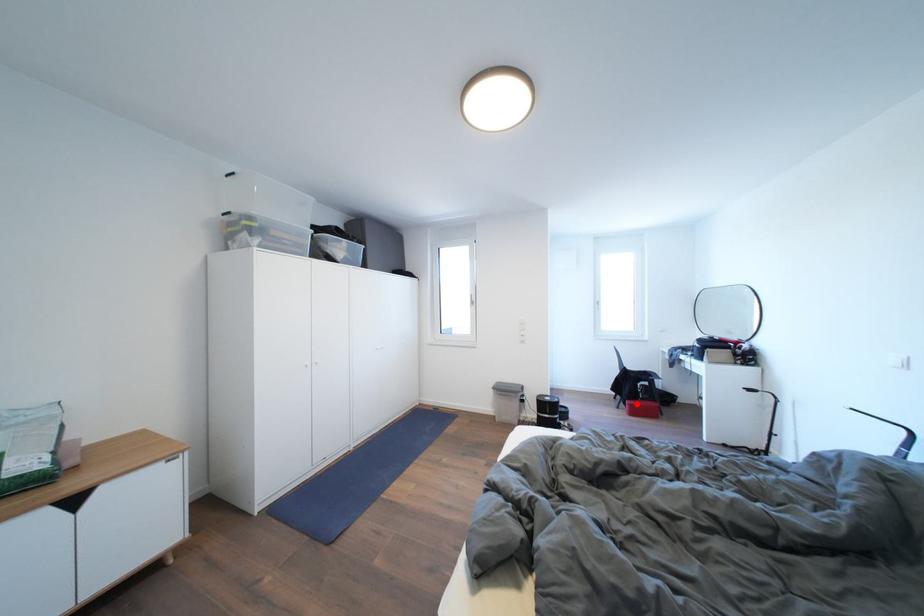
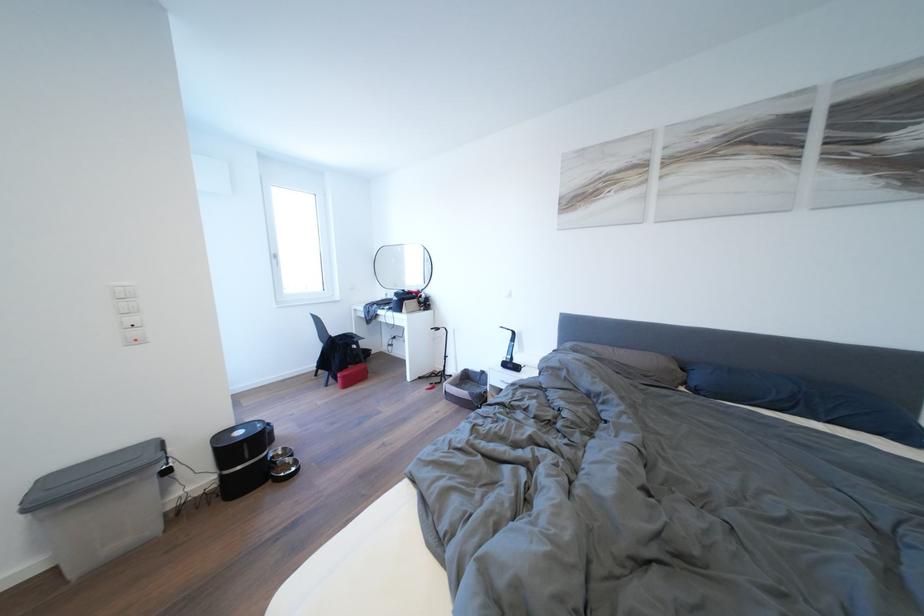
Question: I am providing you with two images of the same scene from different viewpoints. In image1, a red point is highlighted. Considering the same 3D point in image2, which of the following is correct?

Choices:
 (A) It is closer
 (B) It is farther

Answer: (A)